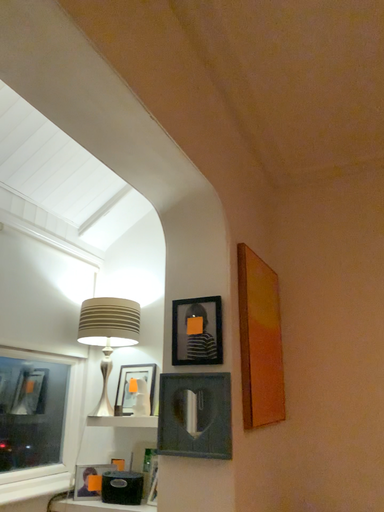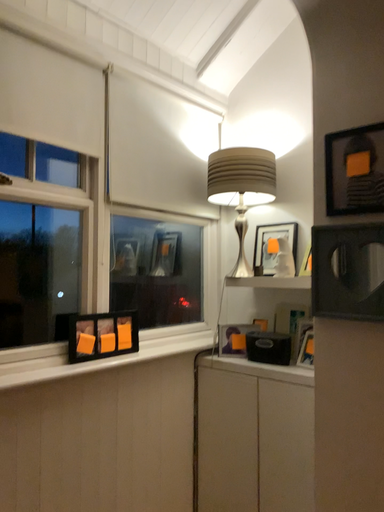
Question: Which way did the camera rotate in the video?

Choices:
 (A) rotated downward
 (B) rotated upward

Answer: (A)